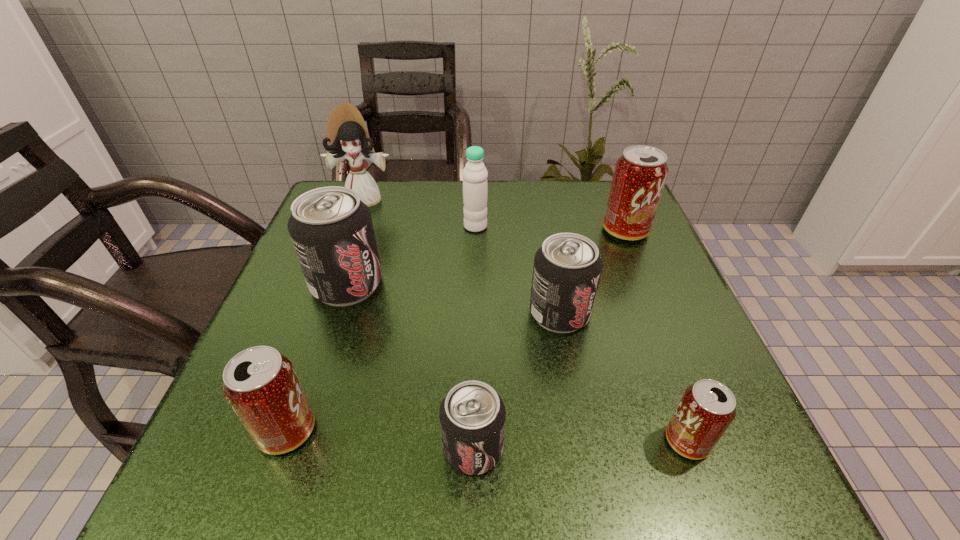
The width and height of the screenshot is (960, 540). What are the coordinates of `free space that satisfies the following two spatial constraints: 1. at the front face of the black doll; 2. on the left side of the fourth soda can from left to right` in the screenshot? It's located at (324, 313).

At what (x,y) coordinates should I click in order to perform the action: click on free point that satisfies the following two spatial constraints: 1. at the front face of the leftmost black soda can; 2. on the right side of the doll. Please return your answer as a coordinate pair (x, y). This screenshot has height=540, width=960. Looking at the image, I should click on (334, 285).

Find the location of `free spot that satisfies the following two spatial constraints: 1. at the front face of the farthest object; 2. on the left side of the nearest black soda can`. free spot that satisfies the following two spatial constraints: 1. at the front face of the farthest object; 2. on the left side of the nearest black soda can is located at coordinates (276, 448).

The image size is (960, 540). Find the location of `vacant area that satisfies the following two spatial constraints: 1. at the front face of the biggest black soda can; 2. on the right side of the black doll`. vacant area that satisfies the following two spatial constraints: 1. at the front face of the biggest black soda can; 2. on the right side of the black doll is located at coordinates (334, 285).

Where is `vacant region that satisfies the following two spatial constraints: 1. on the back side of the water bottle; 2. on the left side of the biggest black soda can`? This screenshot has width=960, height=540. vacant region that satisfies the following two spatial constraints: 1. on the back side of the water bottle; 2. on the left side of the biggest black soda can is located at coordinates (366, 226).